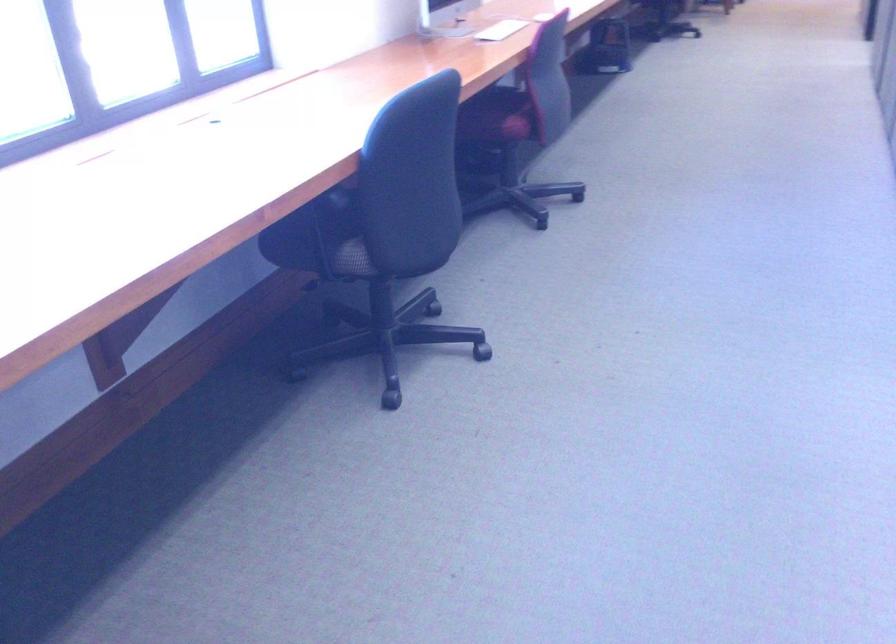
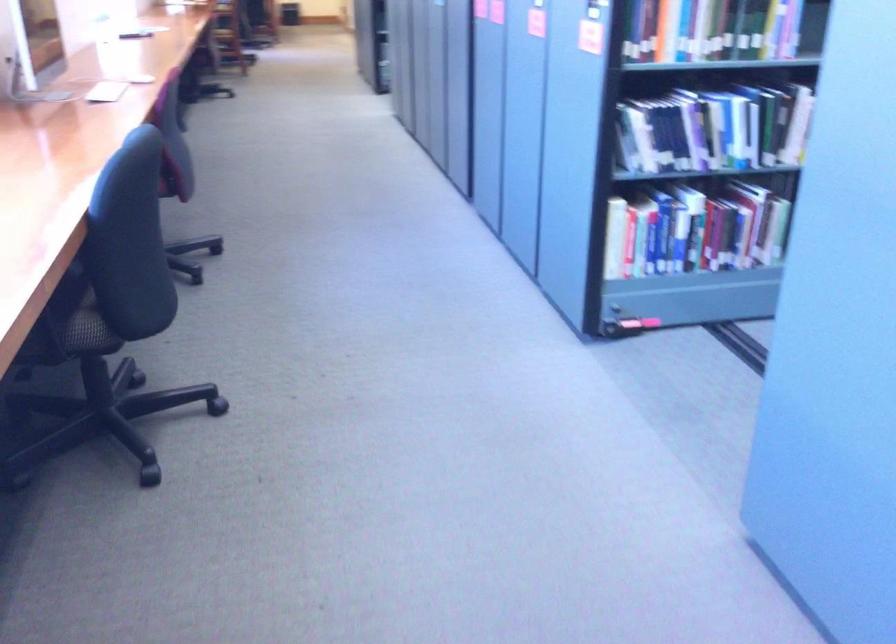
Where in the second image is the point corresponding to point 336,251 from the first image?

(73, 324)